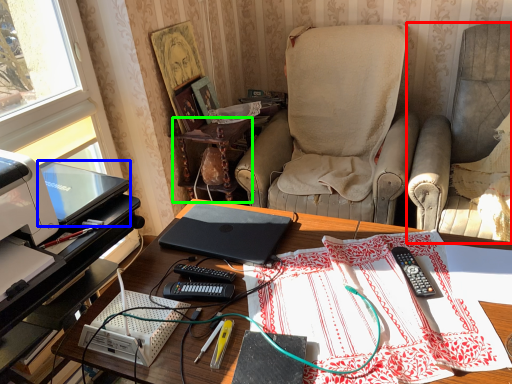
Question: Which object is the closest to the chair (highlighted by a red box)? Choose among these: laptop (highlighted by a blue box) or side table (highlighted by a green box).

Choices:
 (A) laptop
 (B) side table

Answer: (B)